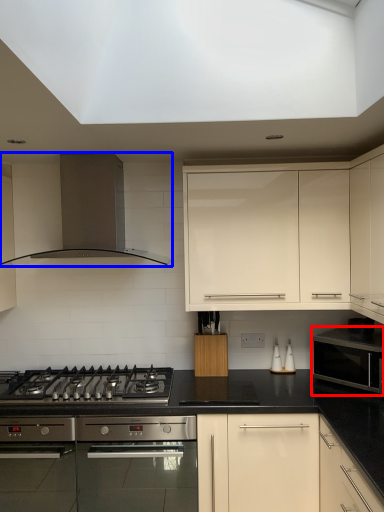
Question: Among these objects, which one is nearest to the camera, microwave oven (highlighted by a red box) or kitchen appliance (highlighted by a blue box)?

Choices:
 (A) microwave oven
 (B) kitchen appliance

Answer: (A)